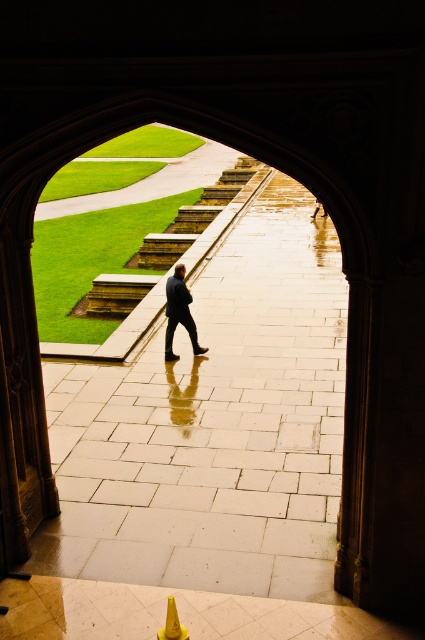
Question: Does light gray stone pavement at center appear on the right side of yellow plastic traffic cone at lower center?

Choices:
 (A) no
 (B) yes

Answer: (B)

Question: Among these points, which one is farthest from the camera?

Choices:
 (A) (187, 321)
 (B) (173, 625)

Answer: (A)

Question: Which point appears closest to the camera in this image?

Choices:
 (A) (170, 634)
 (B) (266, 364)

Answer: (A)

Question: Does light gray stone pavement at center appear over yellow plastic traffic cone at lower center?

Choices:
 (A) yes
 (B) no

Answer: (A)

Question: Which point is farther to the camera?

Choices:
 (A) yellow plastic traffic cone at lower center
 (B) light gray stone pavement at center

Answer: (B)

Question: Does dark blue suit at center come behind yellow plastic traffic cone at lower center?

Choices:
 (A) no
 (B) yes

Answer: (B)